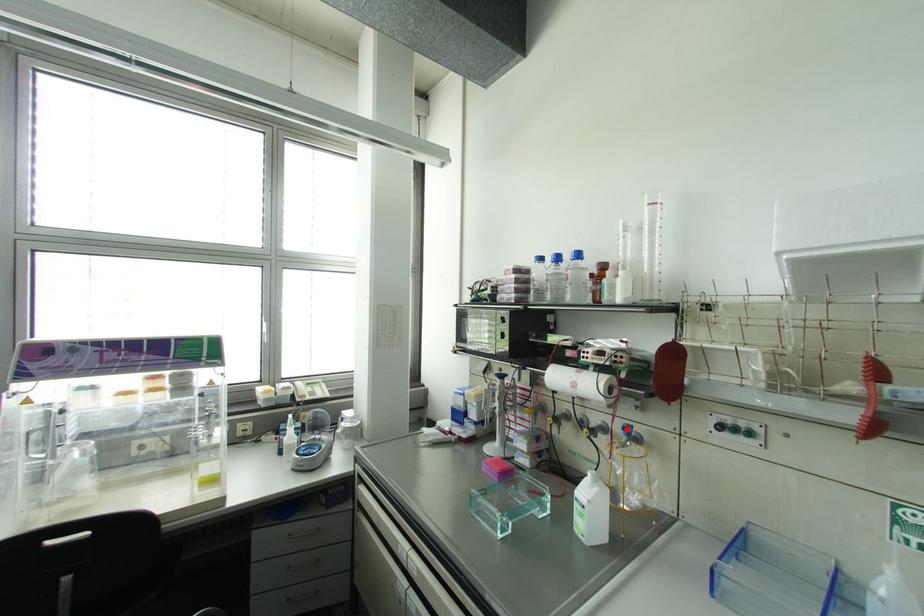
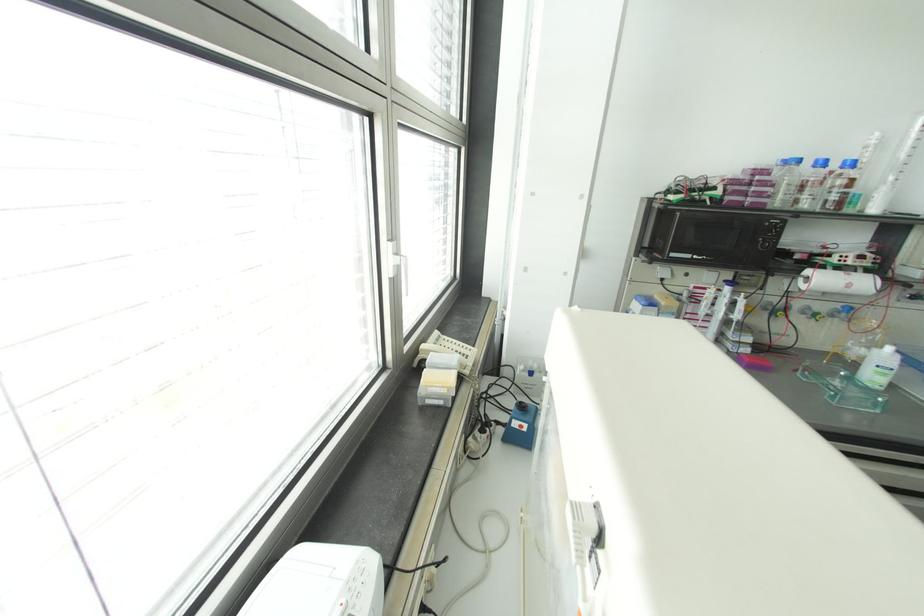
Locate, in the second image, the point that corresponds to the highlighted location in the first image.

(848, 309)